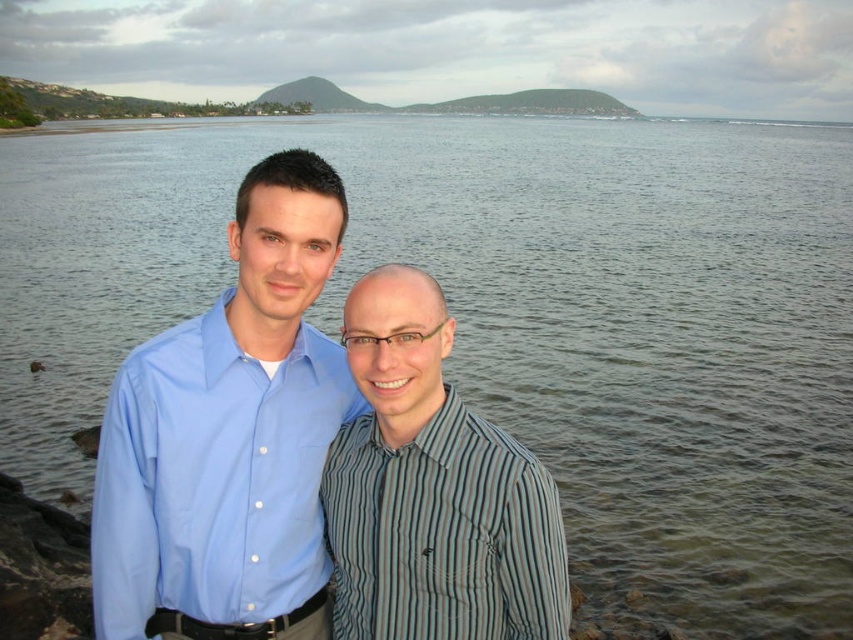
You are a photographer trying to capture a group photo of the two people in the image. The blue smooth shirt at center and the light blue cotton shirt at center are standing side by side. Based on their heights, which one should you position closer to the camera to ensure both appear equally tall in the photo?

The blue smooth shirt at center is much taller than the light blue cotton shirt at center. To make them appear equally tall in the photo, position the light blue cotton shirt at center closer to the camera since it is shorter, while the taller blue smooth shirt at center can be placed slightly farther back.

You are a photographer trying to capture a clear portrait of both the blue smooth shirt at center and the striped cotton shirt at center. Since you want to focus on their faces, which shirt should you adjust the camera focus to prioritize based on their height?

The blue smooth shirt at center is taller than the striped cotton shirt at center, so you should prioritize focusing on the blue smooth shirt at center to ensure both faces are in clear view.

You are a photographer trying to position a model wearing a light blue cotton shirt at center in the frame. According to the scene, where should you place the model?

The light blue cotton shirt at center should be placed at point (213, 477) to match the scene.